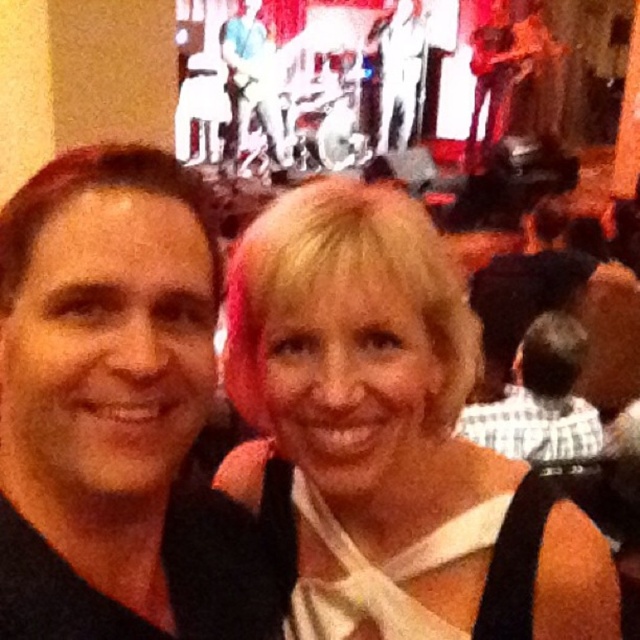
Does point (291, 451) come behind point (548, 324)?

No, it is in front of (548, 324).

Which of these two, blonde hair at center or white checkered shirt at center, stands taller?

blonde hair at center is taller.

Which is behind, point (500, 545) or point (460, 428)?

Positioned behind is point (460, 428).

Locate an element on the screen. The image size is (640, 640). blonde hair at center is located at coordinates (387, 436).

Is black matte hair at center shorter than white checkered shirt at center?

No, black matte hair at center is not shorter than white checkered shirt at center.

Is black matte hair at center thinner than white checkered shirt at center?

Indeed, black matte hair at center has a lesser width compared to white checkered shirt at center.

Between point (116, 417) and point (465, 422), which one is positioned in front?

Positioned in front is point (116, 417).

I want to click on black matte hair at center, so click(x=115, y=410).

Does point (305, 451) come closer to viewer compared to point (161, 188)?

No, it is behind (161, 188).

In the scene shown: Is blonde hair at center to the right of black matte hair at center from the viewer's perspective?

Correct, you'll find blonde hair at center to the right of black matte hair at center.

Measure the distance between blonde hair at center and camera.

blonde hair at center is 34.73 inches away from camera.

Where is `blonde hair at center`? The height and width of the screenshot is (640, 640). blonde hair at center is located at coordinates (387, 436).